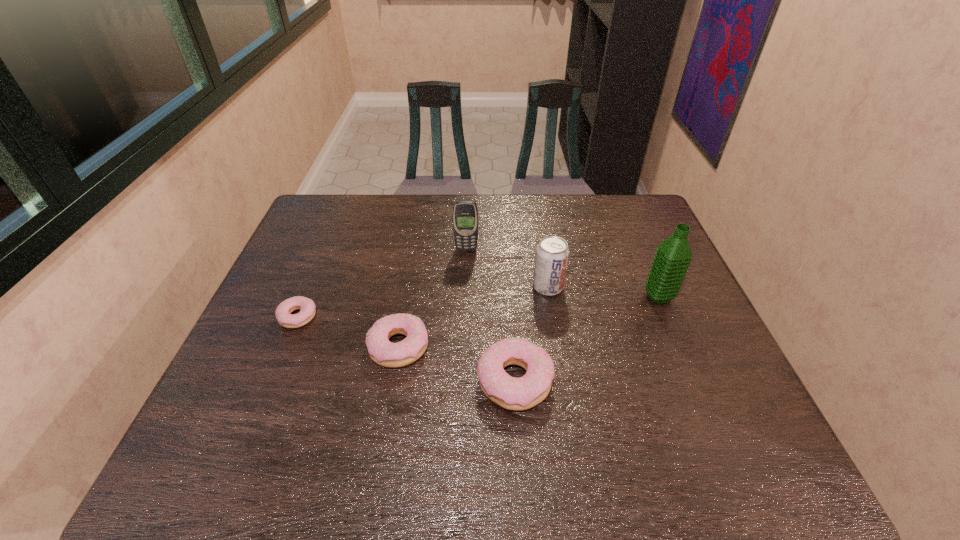
Locate an element on the screen. This screenshot has width=960, height=540. vacant space situated on the back of the second doughnut from left to right is located at coordinates (411, 277).

Find the location of a particular element. The height and width of the screenshot is (540, 960). vacant space situated on the back of the rightmost doughnut is located at coordinates (509, 293).

Image resolution: width=960 pixels, height=540 pixels. Identify the location of vacant area located 0.170m on the left of the water bottle. (583, 297).

You are a GUI agent. You are given a task and a screenshot of the screen. Output one action in this format:
    pyautogui.click(x=<x>, y=<y>)
    Task: Click on the vacant space located on the screen of the farthest object
    
    Given the screenshot: What is the action you would take?
    pyautogui.click(x=465, y=305)

Where is `free space located on the right of the fourth shortest object`? free space located on the right of the fourth shortest object is located at coordinates (620, 287).

The height and width of the screenshot is (540, 960). I want to click on object located in the near edge section of the desktop, so click(525, 392).

Locate an element on the screen. This screenshot has height=540, width=960. object that is at the left edge is located at coordinates (307, 307).

I want to click on object present at the right edge, so click(x=673, y=256).

In the image, there is a desktop. At what (x,y) coordinates should I click in order to perform the action: click on free space at the far edge. Please return your answer as a coordinate pair (x, y). Image resolution: width=960 pixels, height=540 pixels. Looking at the image, I should click on (370, 205).

You are a GUI agent. You are given a task and a screenshot of the screen. Output one action in this format:
    pyautogui.click(x=<x>, y=<y>)
    Task: Click on the free space at the near edge
    
    Given the screenshot: What is the action you would take?
    pyautogui.click(x=583, y=392)